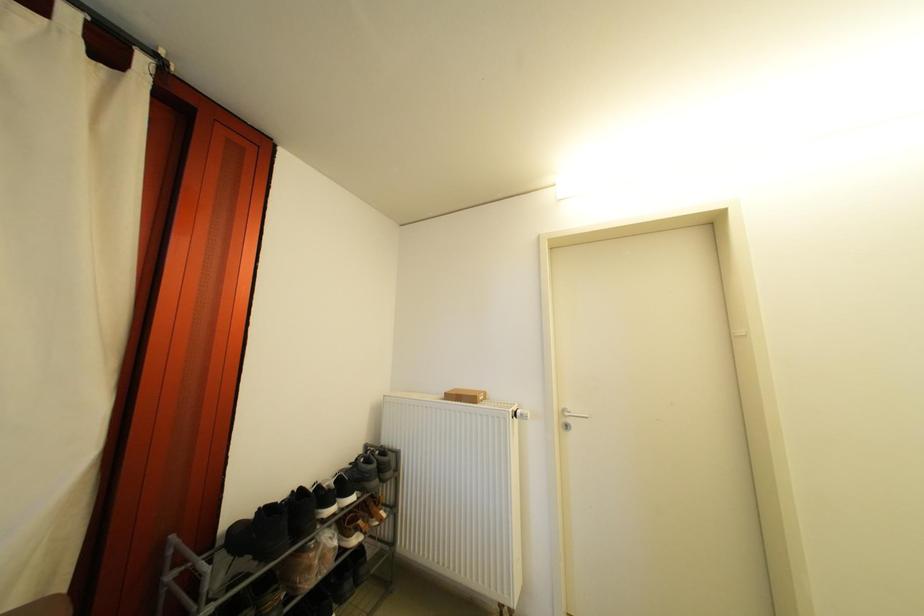
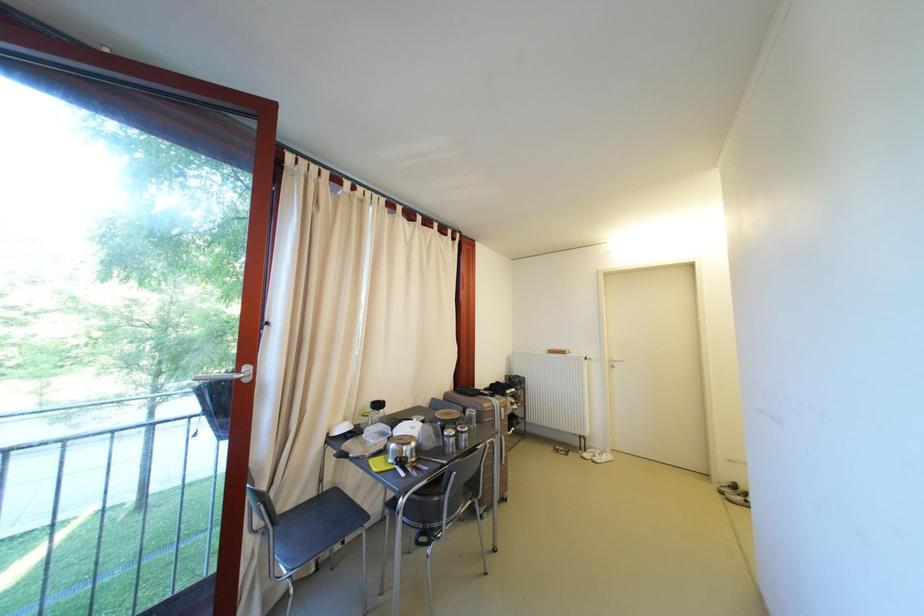
Question: In a continuous first-person perspective shot, in which direction is the camera moving?

Choices:
 (A) Left
 (B) Right
 (C) Forward
 (D) Backward

Answer: (D)